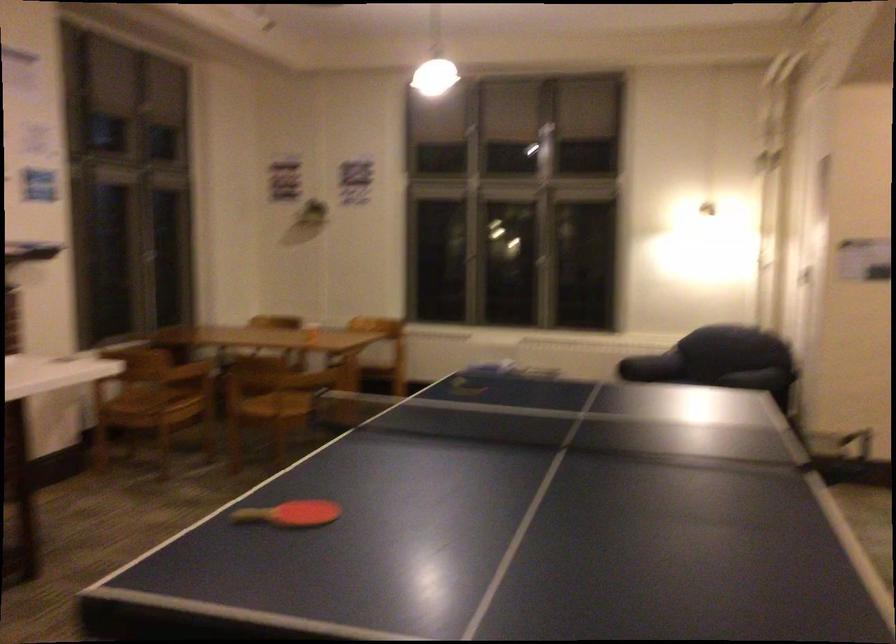
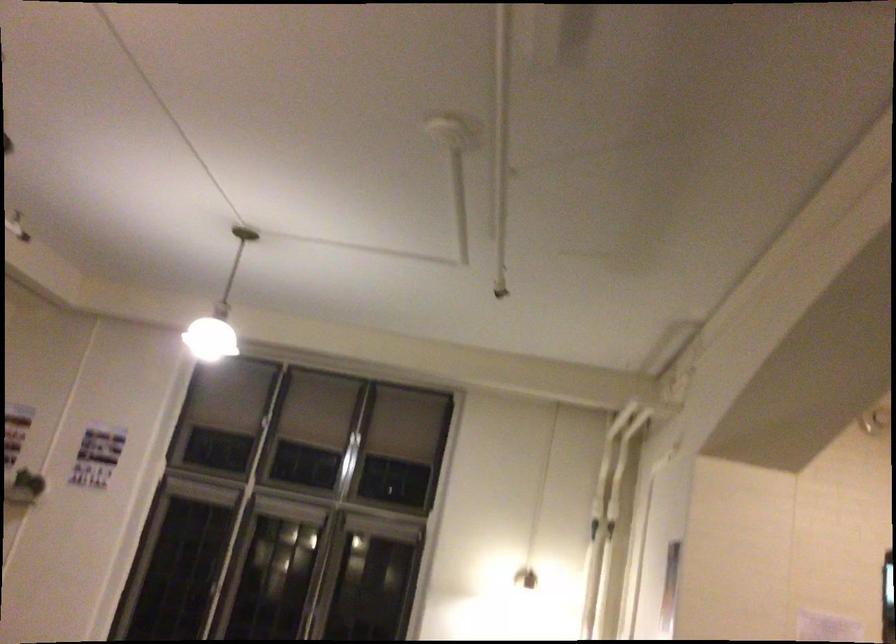
Locate, in the second image, the point that corresponds to pixel 748 105 in the first image.

(613, 527)